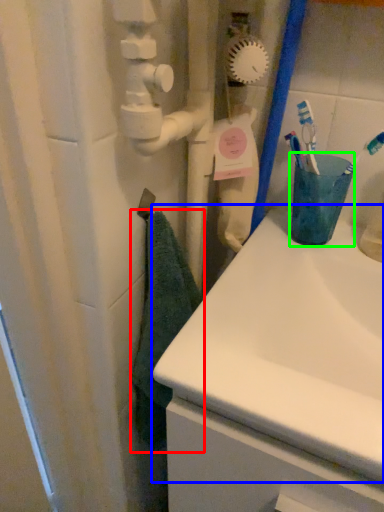
Question: Which object is the closest to the bath towel (highlighted by a red box)? Choose among these: sink (highlighted by a blue box) or turquoise (highlighted by a green box).

Choices:
 (A) sink
 (B) turquoise

Answer: (A)